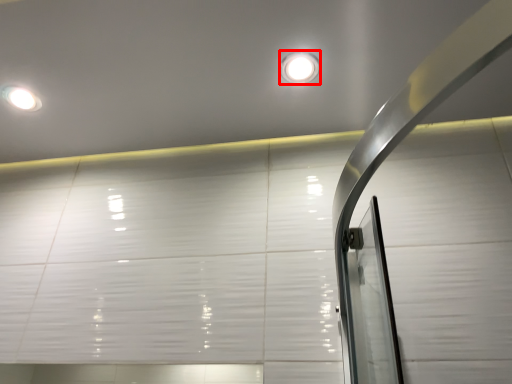
Question: Where is droplight (annotated by the red box) located in relation to droplight in the image?

Choices:
 (A) right
 (B) left

Answer: (A)